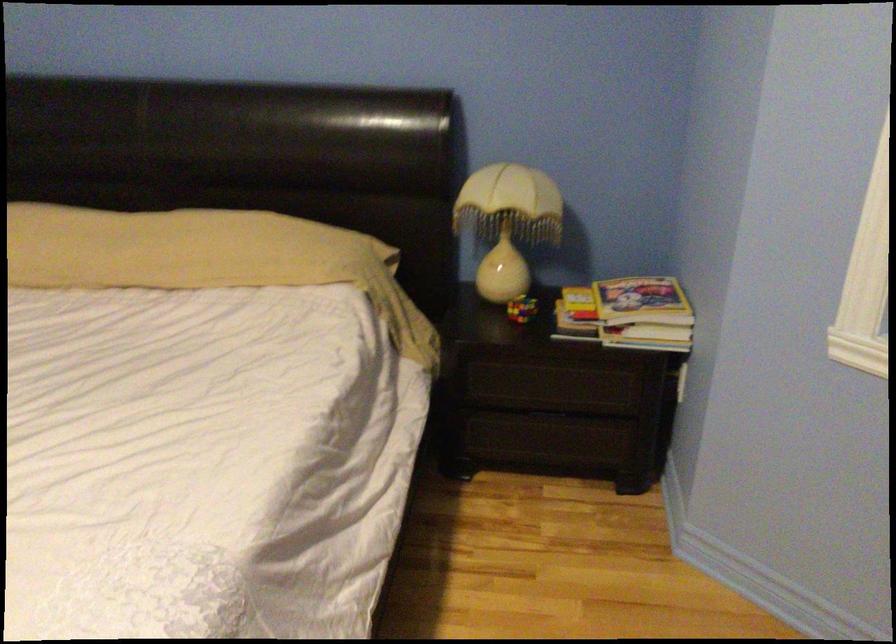
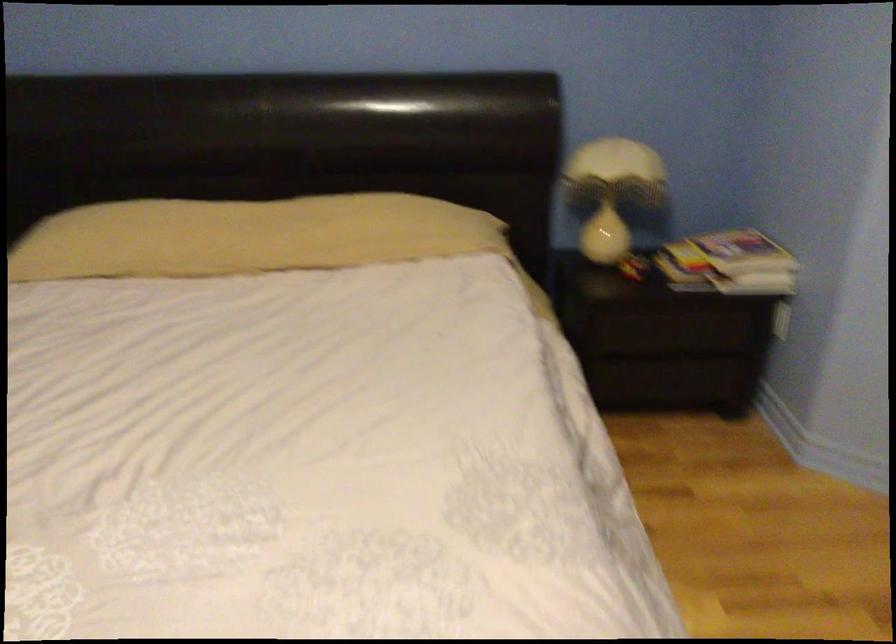
Question: How did the camera likely rotate?

Choices:
 (A) Left
 (B) Right
 (C) Up
 (D) Down

Answer: (B)